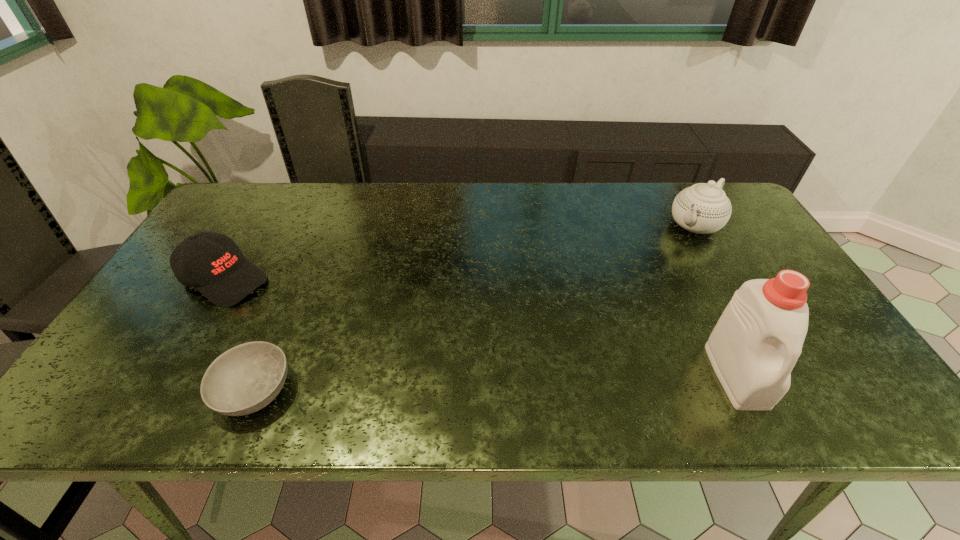
At what (x,y) coordinates should I click in order to perform the action: click on the shortest object. Please return your answer as a coordinate pair (x, y). Image resolution: width=960 pixels, height=540 pixels. Looking at the image, I should click on (246, 378).

Locate an element on the screen. The image size is (960, 540). bowl is located at coordinates (246, 378).

Where is `detergent`? detergent is located at coordinates (753, 348).

The width and height of the screenshot is (960, 540). I want to click on the third shortest object, so click(x=703, y=208).

At what (x,y) coordinates should I click in order to perform the action: click on the farthest object. Please return your answer as a coordinate pair (x, y). Looking at the image, I should click on (703, 208).

Where is `the third nearest object`? This screenshot has height=540, width=960. the third nearest object is located at coordinates (212, 263).

The width and height of the screenshot is (960, 540). I want to click on baseball cap, so click(x=212, y=263).

The width and height of the screenshot is (960, 540). Identify the location of vacant space located 0.170m on the spout of the chinaware. (654, 265).

Find the location of `vacant region located 0.400m on the spout of the chinaware`. vacant region located 0.400m on the spout of the chinaware is located at coordinates (608, 308).

At what (x,y) coordinates should I click in order to perform the action: click on free spot located 0.180m on the spout of the chinaware. Please return your answer as a coordinate pair (x, y). This screenshot has height=540, width=960. Looking at the image, I should click on click(652, 266).